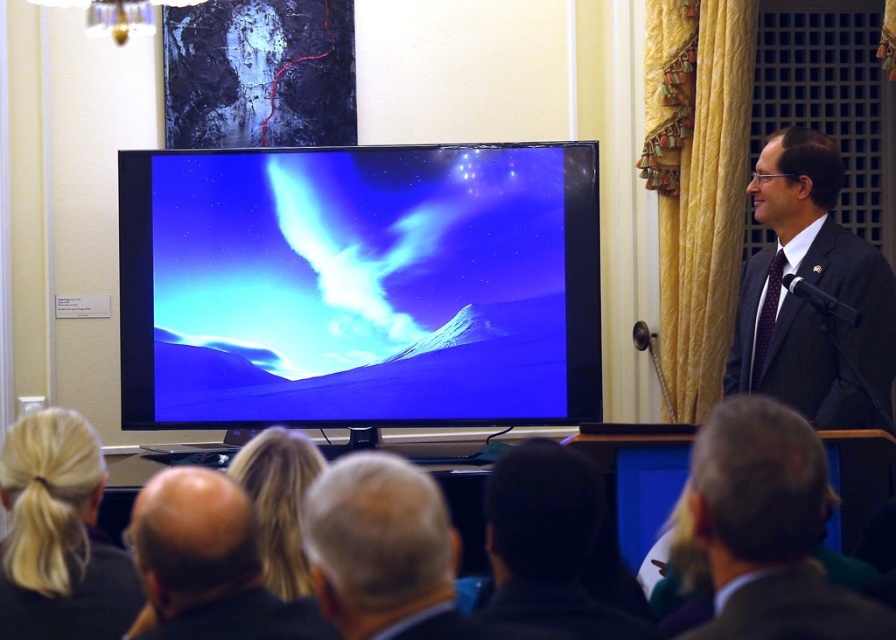
Question: Where is gray hair at center located in relation to bald head at lower left in the image?

Choices:
 (A) below
 (B) above

Answer: (B)

Question: Is dark pinstripe suit at right below blonde hair at lower left?

Choices:
 (A) no
 (B) yes

Answer: (A)

Question: Which of the following is the closest to the observer?

Choices:
 (A) (495, 621)
 (B) (321, 504)
 (C) (52, 589)

Answer: (A)

Question: Which object appears closest to the camera in this image?

Choices:
 (A) dark brown hair at lower center
 (B) matte blue screen at center
 (C) dark pinstripe suit at right
 (D) blonde hair at lower left

Answer: (A)

Question: Which of the following is the farthest from the observer?

Choices:
 (A) matte blue screen at center
 (B) dark brown hair at lower center
 (C) gray hair at center

Answer: (A)

Question: Can you confirm if blonde hair at lower left is bigger than dark brown hair at lower center?

Choices:
 (A) yes
 (B) no

Answer: (A)